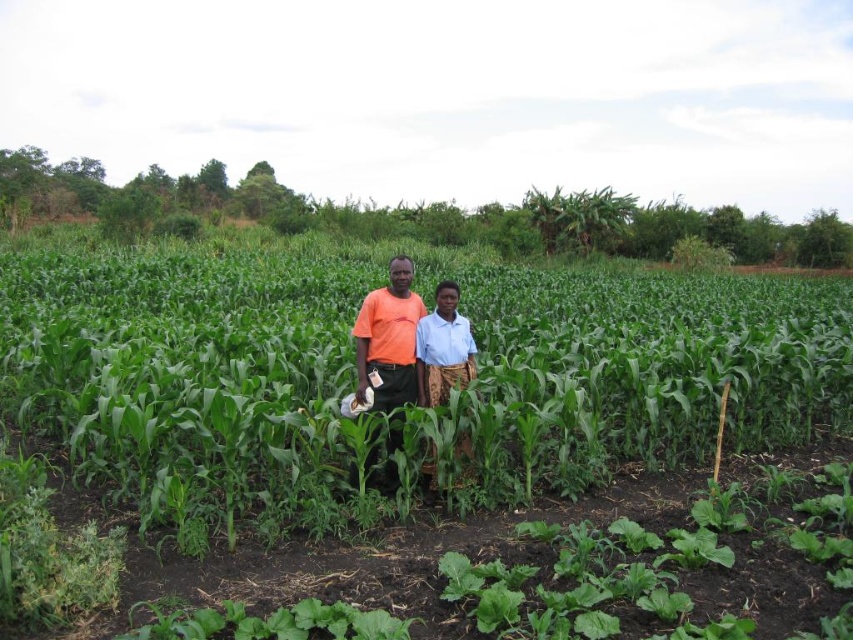
Consider the image. You are a drone operator tasked with capturing aerial footage of the agricultural field. You need to ensure that the orange cotton shirt at center is visible in the shot. Based on its coordinates, where should the drone focus its camera?

The orange cotton shirt at center is located at point (407, 339), so the drone should focus its camera at those coordinates to ensure visibility.